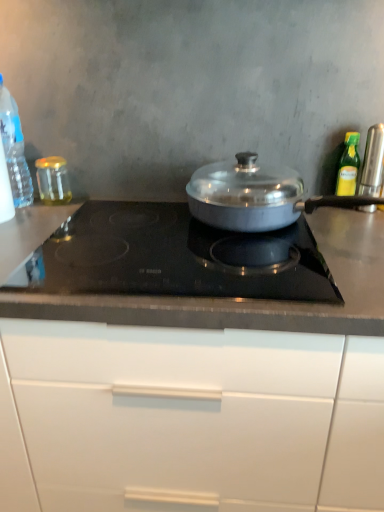
Question: Can you confirm if black glass cooktop at center is wider than satin silver canister at right, which ranks as the 1th kitchen appliance in right-to-left order?

Choices:
 (A) no
 (B) yes

Answer: (B)

Question: Is black glass cooktop at center directly adjacent to satin silver canister at right, which is the fifth kitchen appliance from left to right?

Choices:
 (A) no
 (B) yes

Answer: (A)

Question: Considering the relative positions of black glass cooktop at center and satin silver canister at right, which ranks as the 1th kitchen appliance in right-to-left order, in the image provided, is black glass cooktop at center behind satin silver canister at right, which ranks as the 1th kitchen appliance in right-to-left order,?

Choices:
 (A) no
 (B) yes

Answer: (A)

Question: From a real-world perspective, is black glass cooktop at center under satin silver canister at right, which is the fifth kitchen appliance from left to right?

Choices:
 (A) no
 (B) yes

Answer: (B)

Question: Considering the relative sizes of black glass cooktop at center and satin silver canister at right, which is the fifth kitchen appliance from left to right, in the image provided, is black glass cooktop at center smaller than satin silver canister at right, which is the fifth kitchen appliance from left to right,?

Choices:
 (A) no
 (B) yes

Answer: (A)

Question: Based on their positions, is black glass cooktop at center located to the left or right of green glass bottle at upper right, which is counted as the 2th kitchen appliance, starting from the right?

Choices:
 (A) left
 (B) right

Answer: (A)

Question: From a real-world perspective, is black glass cooktop at center physically located above or below green glass bottle at upper right, which is counted as the 2th kitchen appliance, starting from the right?

Choices:
 (A) below
 (B) above

Answer: (A)

Question: Is black glass cooktop at center taller or shorter than green glass bottle at upper right, which is counted as the 2th kitchen appliance, starting from the right?

Choices:
 (A) tall
 (B) short

Answer: (B)

Question: From the image's perspective, is black glass cooktop at center positioned above or below green glass bottle at upper right, which is counted as the 2th kitchen appliance, starting from the right?

Choices:
 (A) below
 (B) above

Answer: (A)

Question: Considering the relative positions of white glossy cabinet at center and black glass cooktop at center in the image provided, is white glossy cabinet at center to the left or to the right of black glass cooktop at center?

Choices:
 (A) right
 (B) left

Answer: (B)

Question: From the image's perspective, is white glossy cabinet at center above or below black glass cooktop at center?

Choices:
 (A) above
 (B) below

Answer: (B)

Question: Based on their sizes in the image, would you say white glossy cabinet at center is bigger or smaller than black glass cooktop at center?

Choices:
 (A) small
 (B) big

Answer: (B)

Question: Looking at their shapes, would you say white glossy cabinet at center is wider or thinner than black glass cooktop at center?

Choices:
 (A) wide
 (B) thin

Answer: (A)

Question: Is satin silver pan at center, the 3th kitchen appliance when ordered from right to left, wider or thinner than white glossy cabinet at center?

Choices:
 (A) thin
 (B) wide

Answer: (A)

Question: Is point (251, 167) positioned closer to the camera than point (127, 327)?

Choices:
 (A) closer
 (B) farther

Answer: (B)